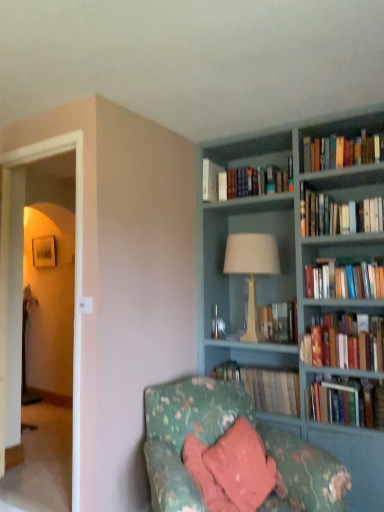
Question: From the image's perspective, is white fabric lampshade at center above or below hardcover books at center, the 6th book positioned from the top?

Choices:
 (A) above
 (B) below

Answer: (A)

Question: Considering the positions of white fabric lampshade at center and hardcover books at center, the 6th book positioned from the top, in the image, is white fabric lampshade at center wider or thinner than hardcover books at center, the 6th book positioned from the top,?

Choices:
 (A) wide
 (B) thin

Answer: (A)

Question: Estimate the real-world distances between objects in this image. Which object is closer to the teal painted wood bookcase at upper right?

Choices:
 (A) hardcover books at center, the 6th book positioned from the top
 (B) hardcover books at upper center, the 7th book from the bottom
 (C) hardcover book at right, the 7th book from the top
 (D) hardcover book at center, which ranks as the 2th book in bottom-to-top order
 (E) white fabric lampshade at center

Answer: (B)

Question: Which of these objects is positioned closest to the hardcover book at center, which ranks as the 2th book in bottom-to-top order?

Choices:
 (A) white fabric lampshade at center
 (B) transparent glass door at left
 (C) hardcover books at center, the 6th book positioned from the top
 (D) hardcover book at right, the 7th book from the top
 (E) floral fabric couch at lower right

Answer: (D)